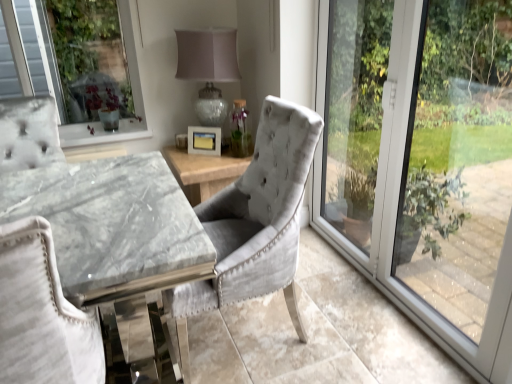
I want to click on transparent glass window at right, so click(x=423, y=163).

Image resolution: width=512 pixels, height=384 pixels. What do you see at coordinates (423, 163) in the screenshot?
I see `transparent glass window at right` at bounding box center [423, 163].

The image size is (512, 384). What do you see at coordinates (255, 222) in the screenshot? I see `velvet grey chair at center, arranged as the first chair when viewed from the right` at bounding box center [255, 222].

Identify the location of white matte picture frame at center. (204, 140).

The height and width of the screenshot is (384, 512). In order to click on matte glass table lamp at center in this screenshot , I will do `click(208, 68)`.

At what (x,y) coordinates should I click in order to perform the action: click on white fabric chair at left, positioned as the 1th chair in left-to-right order. Please return your answer as a coordinate pair (x, y). This screenshot has width=512, height=384. Looking at the image, I should click on (42, 314).

Image resolution: width=512 pixels, height=384 pixels. In order to click on transparent glass window at right in this screenshot , I will do `click(423, 163)`.

Between matte glass table lamp at center and velvet grey chair at center, placed as the 2th chair when sorted from left to right, which one appears on the right side from the viewer's perspective?

Positioned to the right is velvet grey chair at center, placed as the 2th chair when sorted from left to right.

Between matte glass table lamp at center and velvet grey chair at center, placed as the 2th chair when sorted from left to right, which one has larger size?

Bigger between the two is velvet grey chair at center, placed as the 2th chair when sorted from left to right.

There is a matte glass table lamp at center. At what (x,y) coordinates should I click in order to perform the action: click on the 1st chair below it (from the image's perspective). Please return your answer as a coordinate pair (x, y). The width and height of the screenshot is (512, 384). Looking at the image, I should click on (255, 222).

From the picture: Considering the sizes of objects white fabric chair at left, which appears as the second chair when viewed from the right, and velvet grey chair at center, placed as the 2th chair when sorted from left to right, in the image provided, who is smaller, white fabric chair at left, which appears as the second chair when viewed from the right, or velvet grey chair at center, placed as the 2th chair when sorted from left to right,?

white fabric chair at left, which appears as the second chair when viewed from the right, is smaller.

Measure the distance between white fabric chair at left, which appears as the second chair when viewed from the right, and velvet grey chair at center, arranged as the first chair when viewed from the right.

27.61 inches.

Would you say white fabric chair at left, positioned as the 1th chair in left-to-right order, is outside velvet grey chair at center, arranged as the first chair when viewed from the right?

Indeed, white fabric chair at left, positioned as the 1th chair in left-to-right order, is completely outside velvet grey chair at center, arranged as the first chair when viewed from the right.

Can you tell me how much matte glass table lamp at center and transparent glass window at right differ in facing direction?

90 degrees.

This screenshot has height=384, width=512. I want to click on window on the right of matte glass table lamp at center, so click(423, 163).

Between matte glass table lamp at center and transparent glass window at right, which one has larger size?

matte glass table lamp at center.

Looking at this image, how far apart are matte glass table lamp at center and transparent glass window at right?

The distance of matte glass table lamp at center from transparent glass window at right is 1.03 meters.

From the image's perspective, is velvet grey chair at center, arranged as the first chair when viewed from the right, below white matte picture frame at center?

Indeed, from the image's perspective, velvet grey chair at center, arranged as the first chair when viewed from the right, is shown beneath white matte picture frame at center.

Is velvet grey chair at center, arranged as the first chair when viewed from the right, oriented away from white matte picture frame at center?

velvet grey chair at center, arranged as the first chair when viewed from the right, is not turned away from white matte picture frame at center.

Considering the sizes of objects velvet grey chair at center, arranged as the first chair when viewed from the right, and white matte picture frame at center in the image provided, who is smaller, velvet grey chair at center, arranged as the first chair when viewed from the right, or white matte picture frame at center?

With smaller size is white matte picture frame at center.

Considering the sizes of objects velvet grey chair at center, arranged as the first chair when viewed from the right, and white matte picture frame at center in the image provided, who is thinner, velvet grey chair at center, arranged as the first chair when viewed from the right, or white matte picture frame at center?

white matte picture frame at center is thinner.

Is white matte picture frame at center oriented towards velvet grey chair at center, placed as the 2th chair when sorted from left to right?

Yes, white matte picture frame at center faces towards velvet grey chair at center, placed as the 2th chair when sorted from left to right.

From a real-world perspective, relative to velvet grey chair at center, placed as the 2th chair when sorted from left to right, is white matte picture frame at center vertically above or below?

white matte picture frame at center is situated higher than velvet grey chair at center, placed as the 2th chair when sorted from left to right, in the real world.

Is white matte picture frame at center next to velvet grey chair at center, arranged as the first chair when viewed from the right?

They are not placed beside each other.

Does white matte picture frame at center have a greater height compared to velvet grey chair at center, placed as the 2th chair when sorted from left to right?

No.

From a real-world perspective, who is located lower, white fabric chair at left, which appears as the second chair when viewed from the right, or white matte picture frame at center?

white fabric chair at left, which appears as the second chair when viewed from the right.

Is white fabric chair at left, positioned as the 1th chair in left-to-right order, not inside white matte picture frame at center?

Yes, white fabric chair at left, positioned as the 1th chair in left-to-right order, is located beyond the bounds of white matte picture frame at center.

In the scene shown: Between white fabric chair at left, which appears as the second chair when viewed from the right, and white matte picture frame at center, which one has smaller size?

white matte picture frame at center is smaller.

Consider the image. Could you tell me if white fabric chair at left, which appears as the second chair when viewed from the right, is turned towards white matte picture frame at center?

No.

How much distance is there between matte glass table lamp at center and white matte picture frame at center?

12.71 inches.

Considering the relative sizes of matte glass table lamp at center and white matte picture frame at center in the image provided, is matte glass table lamp at center smaller than white matte picture frame at center?

Actually, matte glass table lamp at center might be larger than white matte picture frame at center.

Considering the relative sizes of matte glass table lamp at center and white matte picture frame at center in the image provided, is matte glass table lamp at center thinner than white matte picture frame at center?

Incorrect, the width of matte glass table lamp at center is not less than that of white matte picture frame at center.

From the image's perspective, is matte glass table lamp at center beneath white matte picture frame at center?

No, from the image's perspective, matte glass table lamp at center is not beneath white matte picture frame at center.

This screenshot has height=384, width=512. Identify the location of table lamp that is above the velvet grey chair at center, placed as the 2th chair when sorted from left to right (from the image's perspective). (208, 68).

This screenshot has height=384, width=512. Find the location of `chair above the white fabric chair at left, positioned as the 1th chair in left-to-right order (from a real-world perspective)`. chair above the white fabric chair at left, positioned as the 1th chair in left-to-right order (from a real-world perspective) is located at coordinates tap(255, 222).

Based on their spatial positions, is matte glass table lamp at center or white matte picture frame at center further from white fabric chair at left, positioned as the 1th chair in left-to-right order?

The object further to white fabric chair at left, positioned as the 1th chair in left-to-right order, is matte glass table lamp at center.

Looking at the image, which one is located closer to white fabric chair at left, positioned as the 1th chair in left-to-right order, matte glass table lamp at center or transparent glass window at right?

transparent glass window at right is positioned closer to the anchor white fabric chair at left, positioned as the 1th chair in left-to-right order.

From the image, which object appears to be nearer to velvet grey chair at center, arranged as the first chair when viewed from the right, white fabric chair at left, which appears as the second chair when viewed from the right, or matte glass table lamp at center?

white fabric chair at left, which appears as the second chair when viewed from the right, is closer to velvet grey chair at center, arranged as the first chair when viewed from the right.

Considering their positions, is white matte picture frame at center positioned closer to matte glass table lamp at center than transparent glass window at right?

white matte picture frame at center is closer to matte glass table lamp at center.

Looking at the image, which one is located closer to transparent glass window at right, matte glass table lamp at center or velvet grey chair at center, placed as the 2th chair when sorted from left to right?

Based on the image, velvet grey chair at center, placed as the 2th chair when sorted from left to right, appears to be nearer to transparent glass window at right.

Looking at this image, considering their positions, is velvet grey chair at center, placed as the 2th chair when sorted from left to right, positioned closer to white fabric chair at left, positioned as the 1th chair in left-to-right order, than white matte picture frame at center?

velvet grey chair at center, placed as the 2th chair when sorted from left to right, is closer to white fabric chair at left, positioned as the 1th chair in left-to-right order.

Which object lies nearer to the anchor point white fabric chair at left, which appears as the second chair when viewed from the right, transparent glass window at right or matte glass table lamp at center?

The object closer to white fabric chair at left, which appears as the second chair when viewed from the right, is transparent glass window at right.

Considering their positions, is transparent glass window at right positioned further to white matte picture frame at center than matte glass table lamp at center?

transparent glass window at right.

The image size is (512, 384). I want to click on chair between white fabric chair at left, which appears as the second chair when viewed from the right, and white matte picture frame at center in the front-back direction, so click(255, 222).

What are the coordinates of `chair between transparent glass window at right and matte glass table lamp at center in the front-back direction` in the screenshot? It's located at (255, 222).

Locate an element on the screen. chair between transparent glass window at right and white matte picture frame at center in the front-back direction is located at coordinates (255, 222).

Identify the location of window positioned between white fabric chair at left, positioned as the 1th chair in left-to-right order, and white matte picture frame at center from near to far. This screenshot has width=512, height=384. (423, 163).